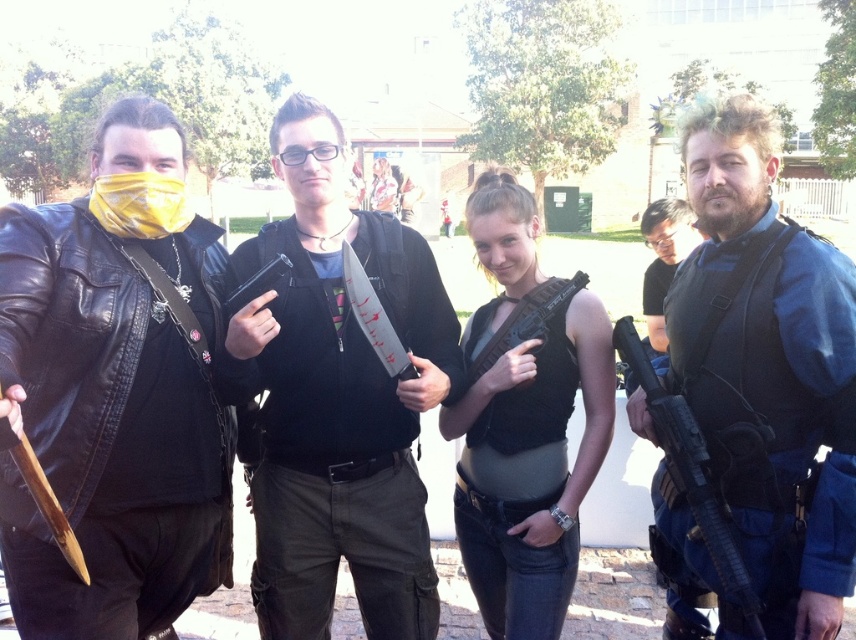
Question: Does blue tactical vest at right appear under matte black vest at right?

Choices:
 (A) yes
 (B) no

Answer: (A)

Question: Is matte black tank top at center below black matte jacket at center?

Choices:
 (A) no
 (B) yes

Answer: (B)

Question: Which of these objects is positioned farthest from the black matte jacket at center?

Choices:
 (A) black matte rifle at right
 (B) blue tactical vest at right
 (C) yellow plastic mask at left
 (D) matte black vest at right

Answer: (D)

Question: Which object is the farthest from the black matte jacket at center?

Choices:
 (A) yellow plastic mask at left
 (B) matte black tank top at center
 (C) black matte vest at center
 (D) blue tactical vest at right

Answer: (D)

Question: Is blue tactical vest at right below black matte rifle at right?

Choices:
 (A) no
 (B) yes

Answer: (A)

Question: Which object appears farthest from the camera in this image?

Choices:
 (A) blue tactical vest at right
 (B) yellow plastic mask at left
 (C) black matte rifle at right

Answer: (B)